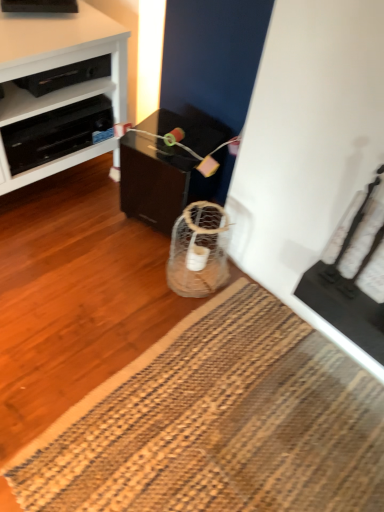
The width and height of the screenshot is (384, 512). I want to click on free location to the left of black glossy table at center, so click(84, 215).